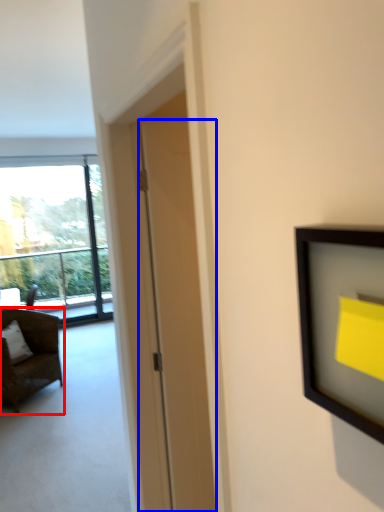
Question: Which point is closer to the camera, chair (highlighted by a red box) or door (highlighted by a blue box)?

Choices:
 (A) chair
 (B) door

Answer: (B)